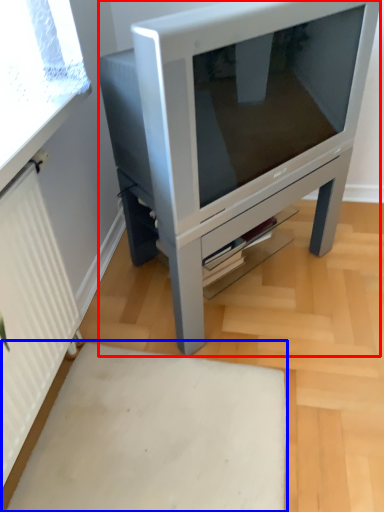
Question: Among these objects, which one is nearest to the camera, furniture (highlighted by a red box) or plain (highlighted by a blue box)?

Choices:
 (A) furniture
 (B) plain

Answer: (B)